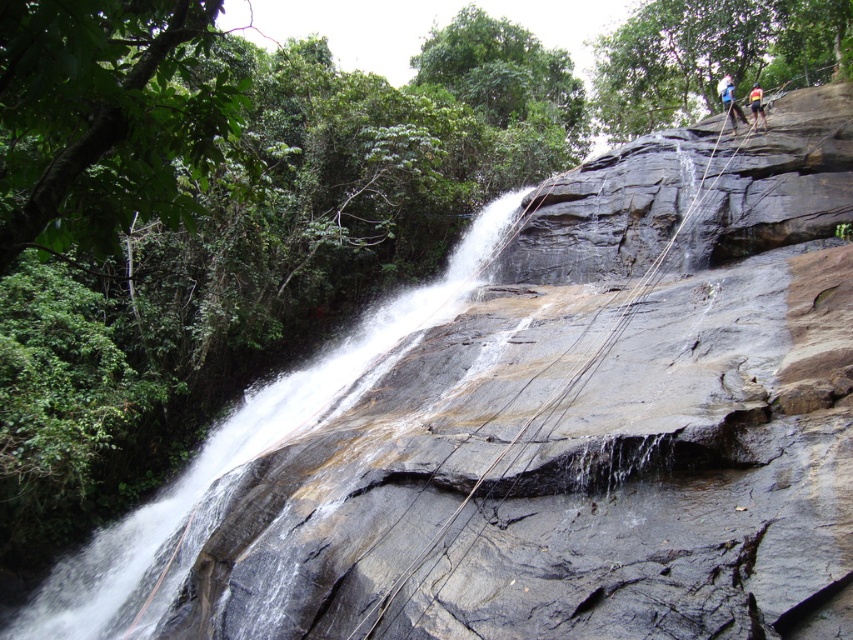
Can you confirm if white smooth waterfall at center is positioned to the left of blue fabric harness at upper right?

Indeed, white smooth waterfall at center is positioned on the left side of blue fabric harness at upper right.

Is point (132, 560) positioned before point (723, 96)?

Yes, point (132, 560) is in front of point (723, 96).

Who is more forward, (305, 397) or (735, 128)?

Point (305, 397)

Identify the location of white smooth waterfall at center. The height and width of the screenshot is (640, 853). (241, 460).

Can you confirm if blue fabric harness at upper right is wider than yellow-orange climbing harness at upper right?

No.

Between blue fabric harness at upper right and yellow-orange climbing harness at upper right, which one is positioned lower?

yellow-orange climbing harness at upper right is lower down.

Who is more distant from viewer, (724, 92) or (758, 88)?

Positioned behind is point (758, 88).

I want to click on blue fabric harness at upper right, so click(x=730, y=102).

Does white smooth waterfall at center have a lesser height compared to yellow-orange climbing harness at upper right?

Incorrect, white smooth waterfall at center's height does not fall short of yellow-orange climbing harness at upper right's.

Is point (119, 541) positioned behind point (761, 93)?

That is False.

Is point (384, 326) closer to viewer compared to point (750, 88)?

Yes, it is in front of point (750, 88).

Find the location of a particular element. The width and height of the screenshot is (853, 640). white smooth waterfall at center is located at coordinates (241, 460).